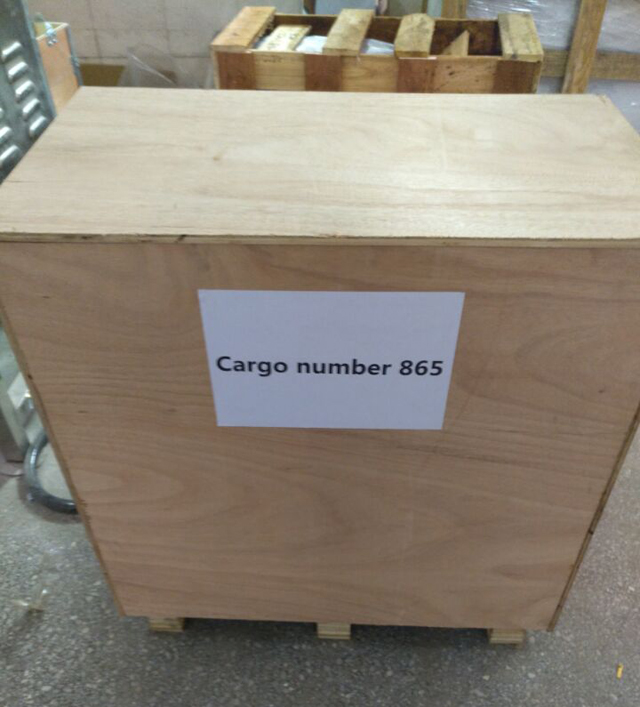
Find the location of a particular element. wooden box supports is located at coordinates (354, 30), (251, 25), (422, 35), (528, 37).